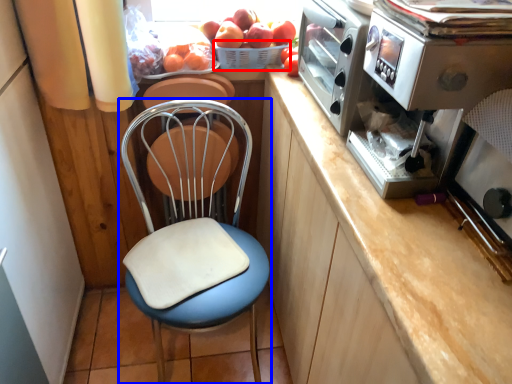
Question: Which object appears closest to the camera in this image, basket (highlighted by a red box) or chair (highlighted by a blue box)?

Choices:
 (A) basket
 (B) chair

Answer: (B)